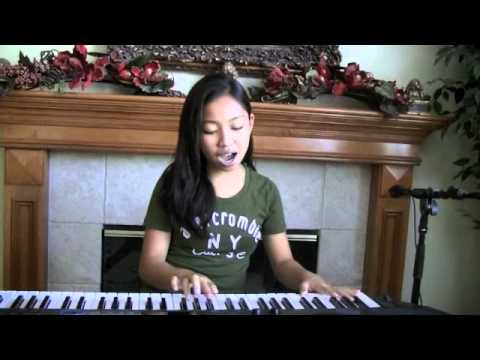
Identify the location of piano. (236, 302).